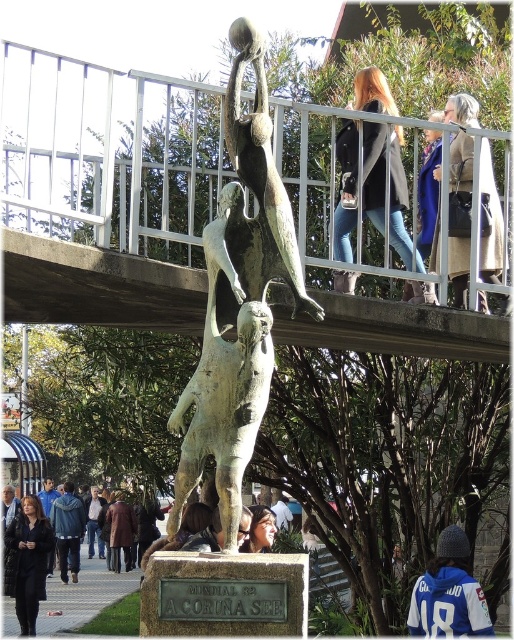
Locate an element on the screen. Image resolution: width=514 pixels, height=640 pixels. bronze statue at center is located at coordinates (238, 301).

In the scene shown: Which of these two, dark brown leather jacket at lower left or white cotton shirt at lower center, stands taller?

dark brown leather jacket at lower left

Between point (52, 483) and point (286, 528), which one is positioned behind?

Point (52, 483)

You are a GUI agent. You are given a task and a screenshot of the screen. Output one action in this format:
    pyautogui.click(x=<x>, y=<y>)
    Task: Click on the dark brown leather jacket at lower left
    The width and height of the screenshot is (514, 640).
    Given the screenshot: What is the action you would take?
    pyautogui.click(x=47, y=497)

From the picture: Is light brown leather jacket at upper right bigger than dark brown leather jacket at lower left?

Correct, light brown leather jacket at upper right is larger in size than dark brown leather jacket at lower left.

Can you confirm if light brown leather jacket at upper right is shorter than dark brown leather jacket at lower left?

No.

Is point (451, 122) less distant than point (46, 502)?

Yes, point (451, 122) is closer to viewer.

Find the location of a particular element. Image resolution: width=514 pixels, height=640 pixels. light brown leather jacket at upper right is located at coordinates (490, 221).